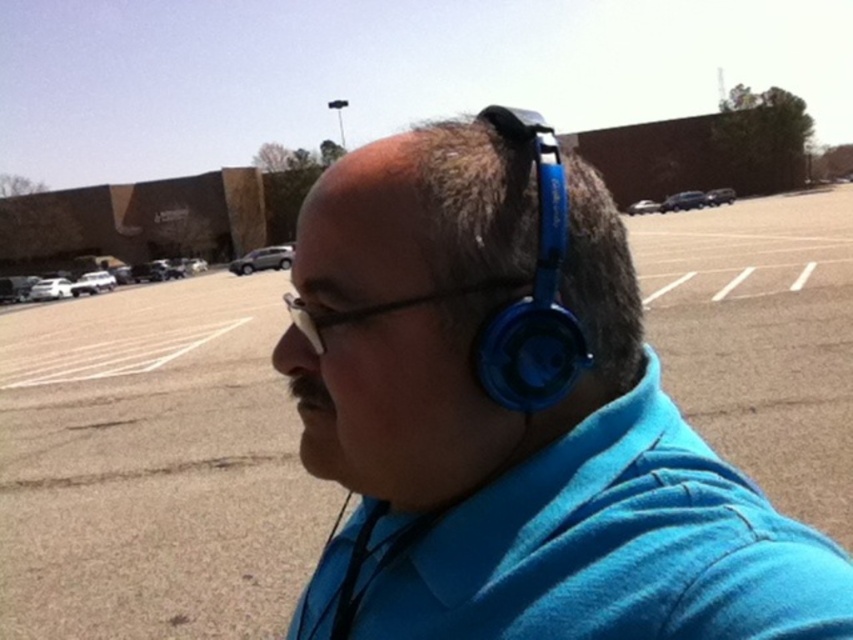
Question: Can you confirm if blue matte headphones at center is wider than blue plastic headphones at upper right?

Choices:
 (A) yes
 (B) no

Answer: (A)

Question: Is blue matte headphones at center positioned behind blue plastic headphones at upper right?

Choices:
 (A) no
 (B) yes

Answer: (A)

Question: Which point is farther from the camera taking this photo?

Choices:
 (A) (546, 192)
 (B) (415, 301)

Answer: (A)

Question: Does blue matte headphones at center appear on the left side of blue plastic headphones at upper right?

Choices:
 (A) yes
 (B) no

Answer: (B)